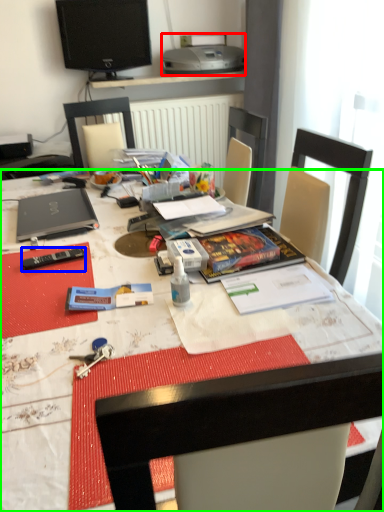
Question: Which object is the farthest from printer (highlighted by a red box)? Choose among these: remote control (highlighted by a blue box) or desk (highlighted by a green box).

Choices:
 (A) remote control
 (B) desk

Answer: (A)